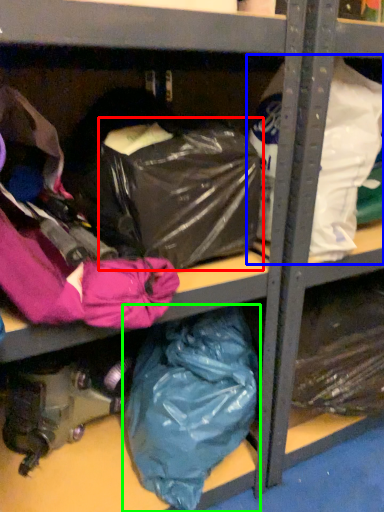
Question: Estimate the real-world distances between objects in this image. Which object is farther from bag (highlighted by a red box), plastic bag (highlighted by a blue box) or plastic bag (highlighted by a green box)?

Choices:
 (A) plastic bag
 (B) plastic bag

Answer: (B)